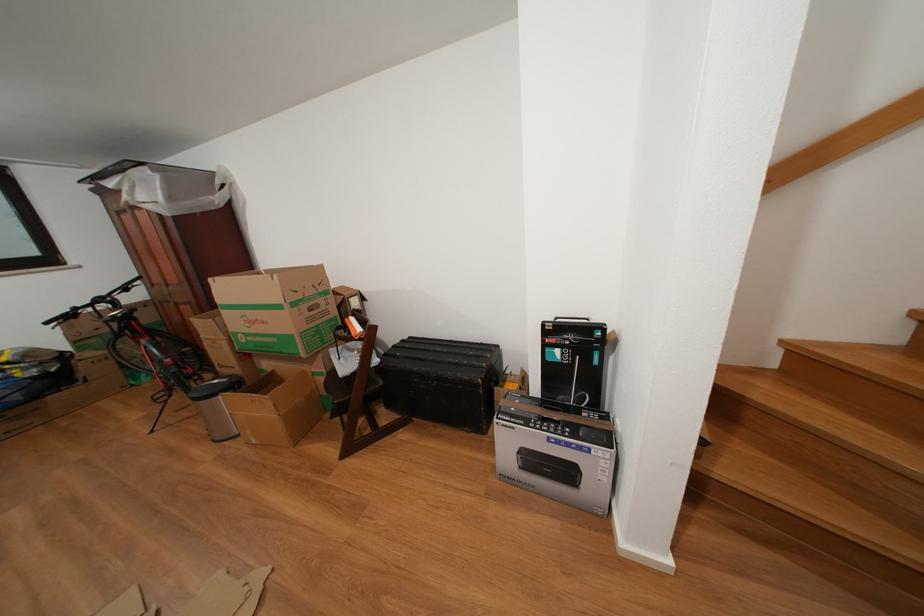
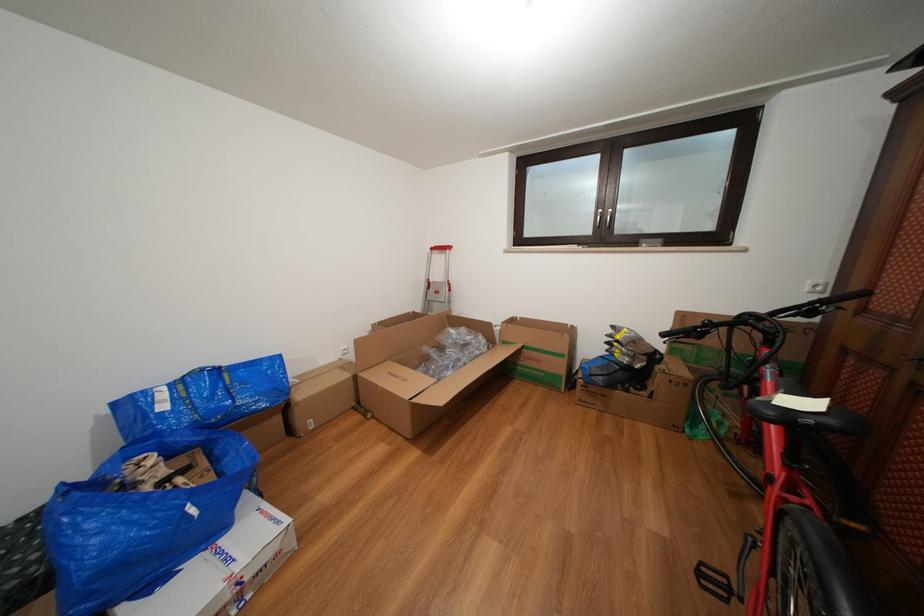
In the second image, find the point that corresponds to (112,300) in the first image.

(772, 315)